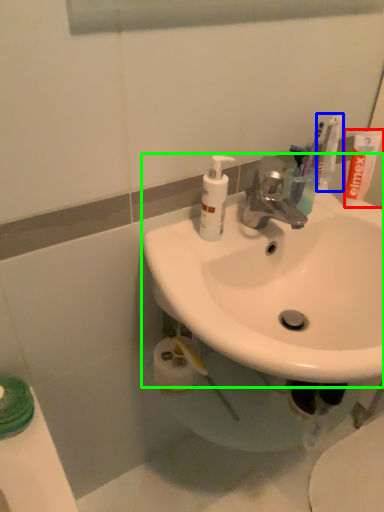
Question: Which object is the farthest from toothpaste (highlighted by a red box)? Choose among these: toothbrush (highlighted by a blue box) or sink (highlighted by a green box).

Choices:
 (A) toothbrush
 (B) sink

Answer: (B)